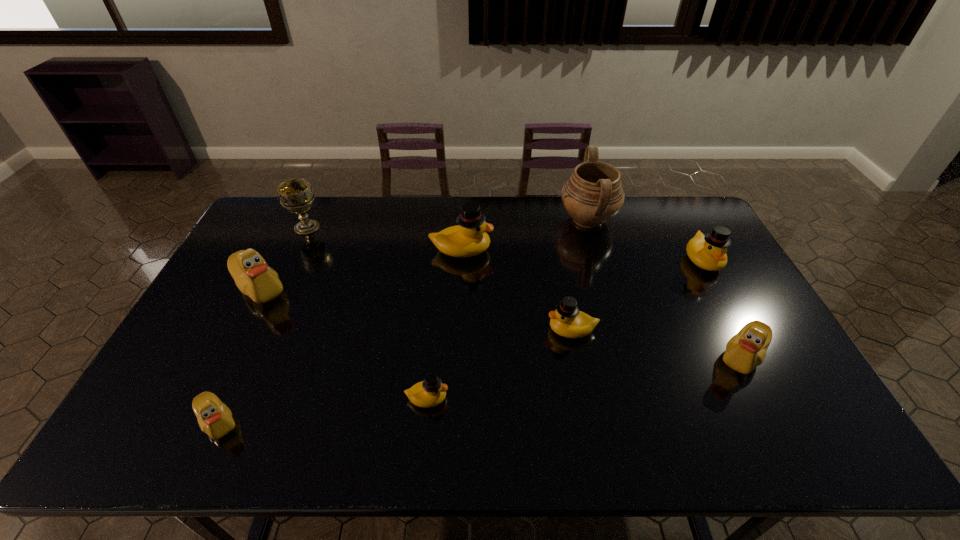
Where is `object present at the near left corner`? object present at the near left corner is located at coordinates (215, 419).

At what (x,y) coordinates should I click in order to perform the action: click on vacant space at the far edge of the desktop. Please return your answer as a coordinate pair (x, y). Image resolution: width=960 pixels, height=540 pixels. Looking at the image, I should click on (509, 208).

This screenshot has height=540, width=960. I want to click on free region at the left edge of the desktop, so click(x=210, y=381).

Where is `vacant area at the right edge`? vacant area at the right edge is located at coordinates (710, 276).

The width and height of the screenshot is (960, 540). I want to click on vacant region at the near right corner, so click(846, 450).

I want to click on blank region between the second farthest beige duck and the second nearest yellow duck, so click(657, 343).

The image size is (960, 540). In order to click on empty space that is in between the third smallest yellow duck and the farthest beige duck in this screenshot , I will do `click(481, 274)`.

The width and height of the screenshot is (960, 540). Find the location of `free space between the second biggest yellow duck and the biggest yellow duck`. free space between the second biggest yellow duck and the biggest yellow duck is located at coordinates (582, 255).

What are the coordinates of `free space between the rightmost beige duck and the tallest object` in the screenshot? It's located at (665, 288).

This screenshot has width=960, height=540. In order to click on free space between the second nearest yellow duck and the farthest beige duck in this screenshot , I will do `click(416, 309)`.